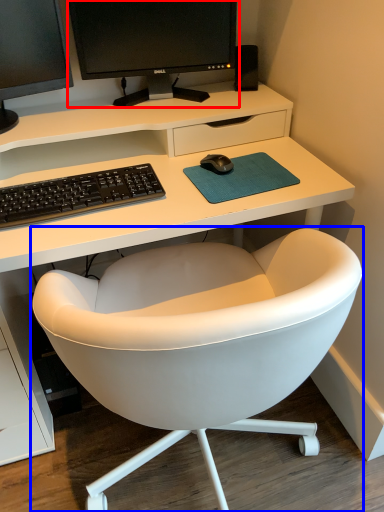
Question: Among these objects, which one is nearest to the camera, computer monitor (highlighted by a red box) or chair (highlighted by a blue box)?

Choices:
 (A) computer monitor
 (B) chair

Answer: (B)